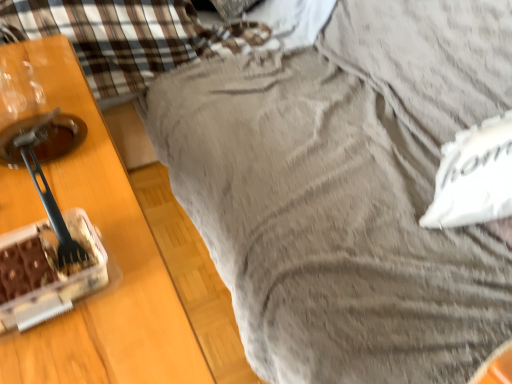
Where is `empty space that is ontop of wooden table at left (from a real-world perspective)`? Image resolution: width=512 pixels, height=384 pixels. empty space that is ontop of wooden table at left (from a real-world perspective) is located at coordinates (51, 146).